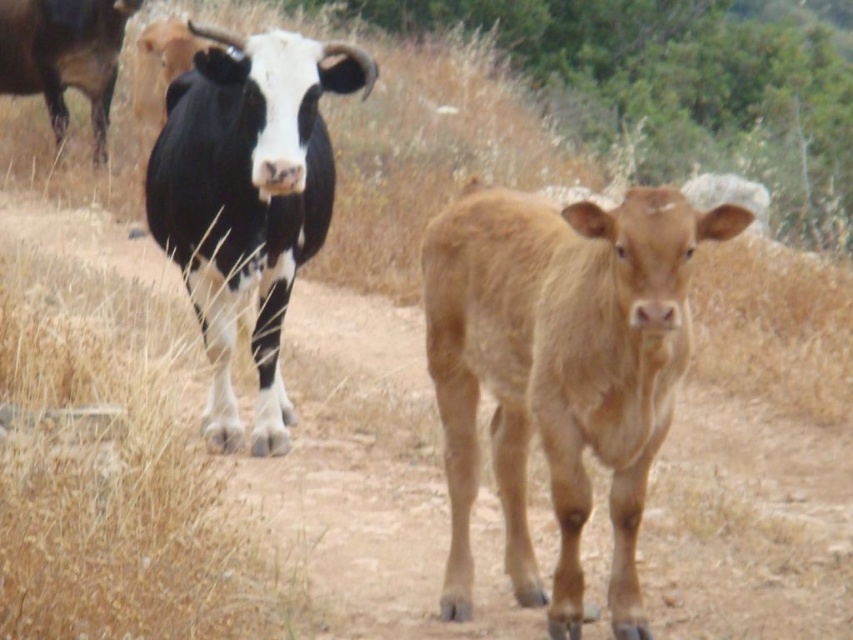
Question: Does black and white fur at center have a smaller size compared to black glossy cow at upper left?

Choices:
 (A) yes
 (B) no

Answer: (B)

Question: From the image, what is the correct spatial relationship of brown smooth calf at center in relation to black and white fur at center?

Choices:
 (A) above
 (B) below

Answer: (B)

Question: Can you confirm if brown smooth calf at center is wider than black glossy cow at upper left?

Choices:
 (A) no
 (B) yes

Answer: (A)

Question: Among these points, which one is farthest from the camera?

Choices:
 (A) (0, 17)
 (B) (286, 58)
 (C) (544, 275)

Answer: (A)

Question: Among these points, which one is farthest from the camera?

Choices:
 (A) (444, 336)
 (B) (96, 81)

Answer: (B)

Question: Which of the following is the farthest from the observer?

Choices:
 (A) (224, 385)
 (B) (96, 74)
 (C) (566, 516)

Answer: (B)